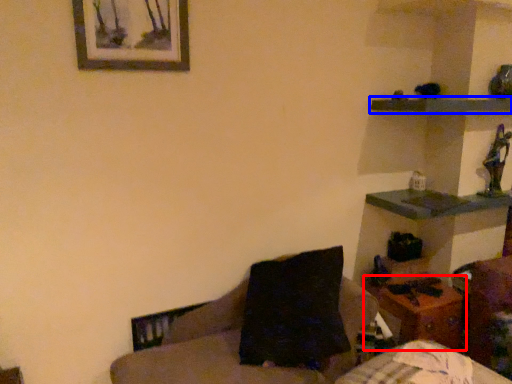
Question: Which point is further to the camera, table (highlighted by a red box) or shelf (highlighted by a blue box)?

Choices:
 (A) table
 (B) shelf

Answer: (A)